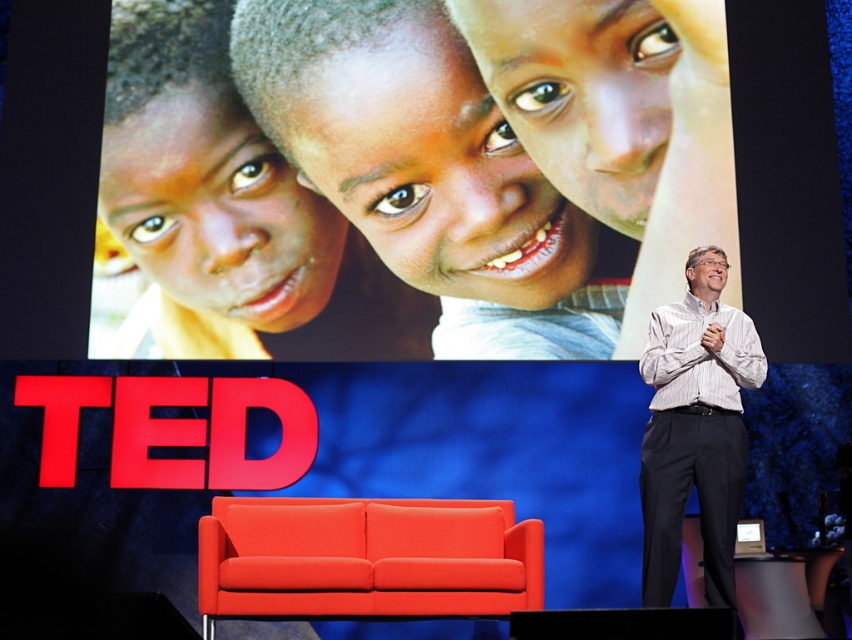
How much distance is there between matte orange couch at lower center and white striped shirt at right?

A distance of 3.96 feet exists between matte orange couch at lower center and white striped shirt at right.

Who is more forward, (x=369, y=554) or (x=728, y=458)?

Point (x=728, y=458) is more forward.

Locate an element on the screen. This screenshot has width=852, height=640. matte orange couch at lower center is located at coordinates (367, 557).